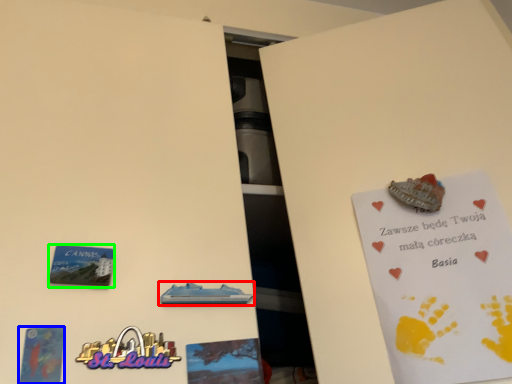
Question: Based on their relative distances, which object is farther from vehicle (highlighted by a red box)? Choose from postcard (highlighted by a blue box) and plaque (highlighted by a green box).

Choices:
 (A) postcard
 (B) plaque

Answer: (A)